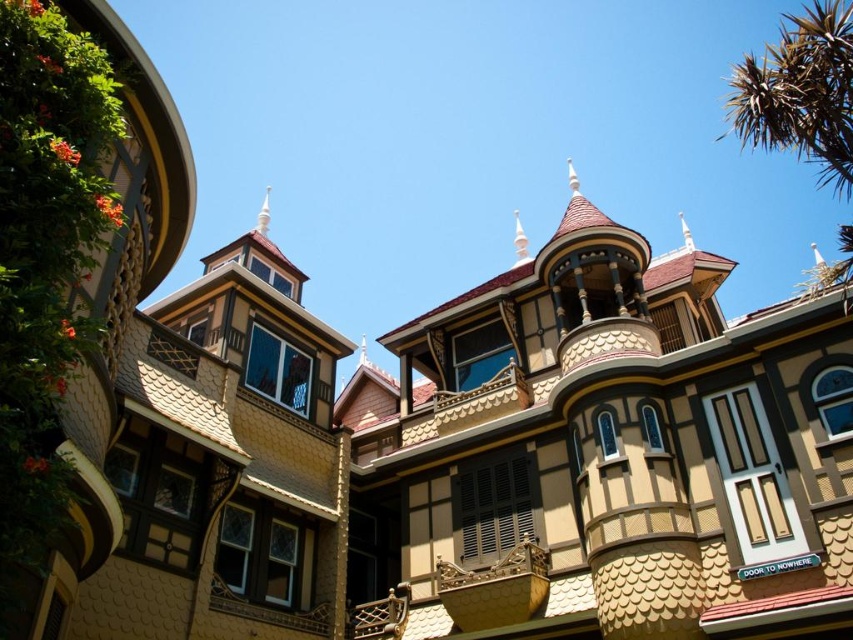
Question: Does beige scalloped siding at center have a larger size compared to green spiky leaves at upper right?

Choices:
 (A) no
 (B) yes

Answer: (A)

Question: Is beige scalloped siding at center positioned behind green spiky leaves at upper right?

Choices:
 (A) yes
 (B) no

Answer: (A)

Question: Is beige scalloped siding at center wider than green spiky leaves at upper right?

Choices:
 (A) yes
 (B) no

Answer: (B)

Question: Which point is closer to the camera?

Choices:
 (A) (749, 540)
 (B) (851, 166)

Answer: (A)